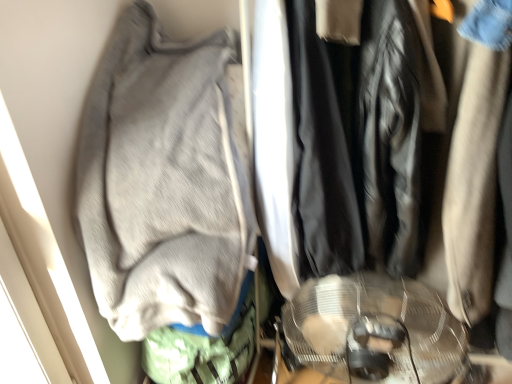
At what (x,y) coordinates should I click in order to perform the action: click on gray fleece jacket at left. Please return your answer as a coordinate pair (x, y). The image size is (512, 384). Looking at the image, I should click on (162, 181).

The height and width of the screenshot is (384, 512). Describe the element at coordinates (162, 181) in the screenshot. I see `gray fleece jacket at left` at that location.

At what (x,y) coordinates should I click in order to perform the action: click on gray fleece jacket at left. Please return your answer as a coordinate pair (x, y). The height and width of the screenshot is (384, 512). Looking at the image, I should click on (162, 181).